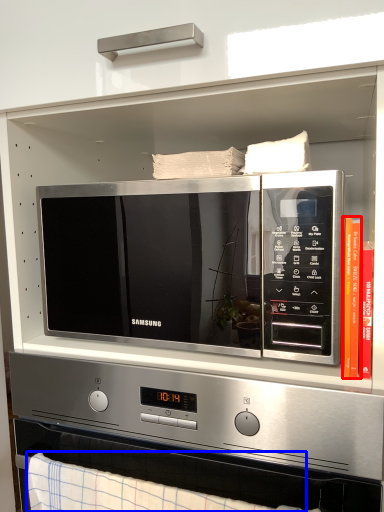
Question: Which of the following is the closest to the observer, book (highlighted by a red box) or blanket (highlighted by a blue box)?

Choices:
 (A) book
 (B) blanket

Answer: (B)